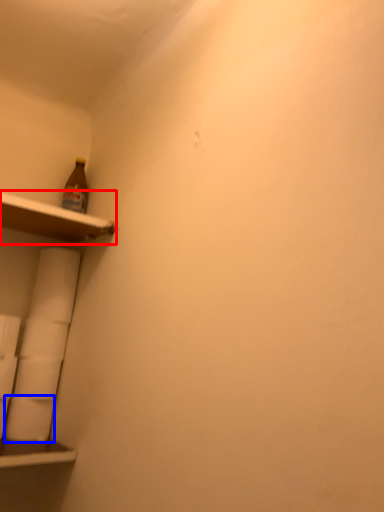
Question: Among these objects, which one is nearest to the camera, shelf (highlighted by a red box) or toilet paper (highlighted by a blue box)?

Choices:
 (A) shelf
 (B) toilet paper

Answer: (A)